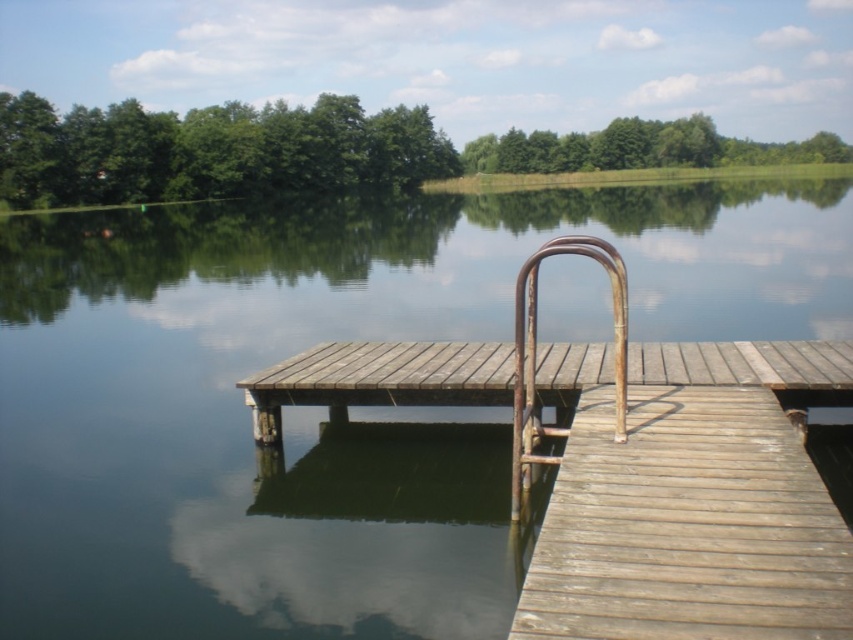
Question: Observing the image, what is the correct spatial positioning of weathered wood dock at center in reference to rusty metal rail at center?

Choices:
 (A) below
 (B) above

Answer: (A)

Question: Is transparent water at center bigger than rusty metal rail at center?

Choices:
 (A) yes
 (B) no

Answer: (A)

Question: Among these points, which one is nearest to the camera?

Choices:
 (A) (525, 486)
 (B) (723, 358)
 (C) (202, 317)

Answer: (A)

Question: Which point appears farthest from the camera in this image?

Choices:
 (A) (50, 566)
 (B) (521, 310)
 (C) (555, 376)

Answer: (C)

Question: Does transparent water at center have a greater width compared to weathered wood dock at center?

Choices:
 (A) no
 (B) yes

Answer: (B)

Question: Estimate the real-world distances between objects in this image. Which object is farther from the transparent water at center?

Choices:
 (A) rusty metal rail at center
 (B) weathered wood dock at center

Answer: (B)